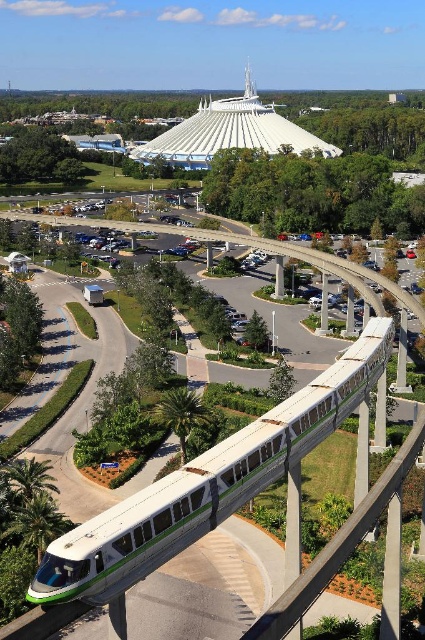
You are standing at the entrance of the futuristic dome structure and want to board the green matte monorail at center. According to the coordinates provided, is the monorail directly in front of you or to one side?

The green matte monorail at center is located at point coordinates, so it is directly in front of you.

You are a tourist standing at the entrance of the park and want to take a photo of the white smooth dome at upper center without the green matte monorail at center blocking the view. Is this possible?

The green matte monorail at center is located below the white smooth dome at upper center, so you can take a photo of the white smooth dome at upper center without the green matte monorail at center blocking the view by positioning yourself so the monorail is below the dome in the frame.

You are a tourist standing on the platform waiting for the green matte monorail at center. You look up and see the white smooth dome at upper center. Which object is closer to you?

The green matte monorail at center is closer to the viewer than the white smooth dome at upper center.